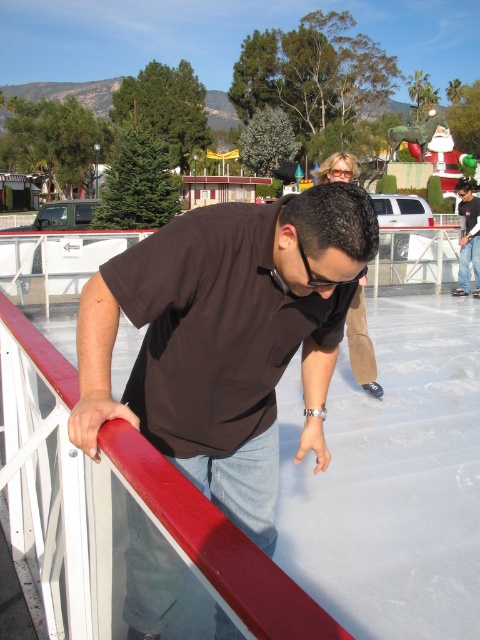
You are an event organizer planning to place two banners on the ice rink. The banners must be placed near the matte black shirt at center and the brown matte shirt at center. Which banner should be smaller to ensure it doesn

The banner near the matte black shirt at center should be smaller since the matte black shirt at center occupies less space than the brown matte shirt at center.

You are standing at the edge of the ice skating rink and see two points marked on the ice. The first point is at coordinates point(309,438) and the second point is at point(476,228). Which point is closer to you?

Point(309,438) is closer to the viewer than point(476,228).